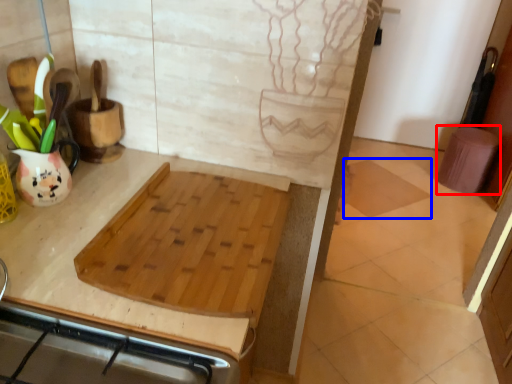
Question: Which object appears farthest to the camera in this image, step stool (highlighted by a red box) or tile (highlighted by a blue box)?

Choices:
 (A) step stool
 (B) tile

Answer: (A)